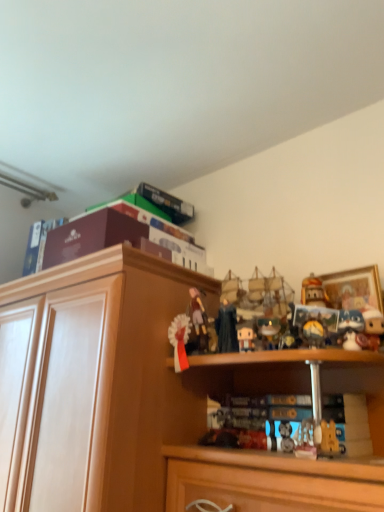
The height and width of the screenshot is (512, 384). Find the location of `wooden cabinet at upper center`. wooden cabinet at upper center is located at coordinates (105, 383).

How much space does white matte figurine at center, which is counted as the 2th toy, starting from the right, occupy horizontally?

white matte figurine at center, which is counted as the 2th toy, starting from the right, is 1.29 inches wide.

The height and width of the screenshot is (512, 384). What do you see at coordinates (179, 340) in the screenshot? I see `white glossy ribbon at center, which ranks as the first toy in left-to-right order` at bounding box center [179, 340].

The image size is (384, 512). Find the location of `wooden cabinet at upper center`. wooden cabinet at upper center is located at coordinates (105, 383).

Which is correct: white matte figurine at center, which is counted as the 2th toy, starting from the right, is inside wooden framed picture at upper right, or outside of it?

white matte figurine at center, which is counted as the 2th toy, starting from the right, cannot be found inside wooden framed picture at upper right.

Is white matte figurine at center, positioned as the fourth toy in left-to-right order, taller than wooden framed picture at upper right?

No.

Considering the sizes of objects white matte figurine at center, positioned as the fourth toy in left-to-right order, and wooden framed picture at upper right in the image provided, who is wider, white matte figurine at center, positioned as the fourth toy in left-to-right order, or wooden framed picture at upper right?

wooden framed picture at upper right.

Does point (239, 337) lie in front of point (375, 287)?

Yes, point (239, 337) is in front of point (375, 287).

Which is more to the right, white matte figurine at center, which is counted as the 2th toy, starting from the right, or maroon cardboard box at upper left, the 3th book in the right-to-left sequence?

From the viewer's perspective, white matte figurine at center, which is counted as the 2th toy, starting from the right, appears more on the right side.

From the image's perspective, which object appears higher, white matte figurine at center, which is counted as the 2th toy, starting from the right, or maroon cardboard box at upper left, the 3th book in the right-to-left sequence?

maroon cardboard box at upper left, the 3th book in the right-to-left sequence, is shown above in the image.

Which object is further away from the camera, white matte figurine at center, which is counted as the 2th toy, starting from the right, or maroon cardboard box at upper left, the 2th book positioned from the left?

Positioned behind is maroon cardboard box at upper left, the 2th book positioned from the left.

Does white matte figurine at center, positioned as the fourth toy in left-to-right order, have a lesser height compared to maroon cardboard box at upper left, the 2th book positioned from the left?

Correct, white matte figurine at center, positioned as the fourth toy in left-to-right order, is not as tall as maroon cardboard box at upper left, the 2th book positioned from the left.

Could you tell me if dark blue fabric figurine at center, which appears as the 3th toy when viewed from the right, is facing white glossy ribbon at center, which ranks as the fifth toy in right-to-left order?

No, dark blue fabric figurine at center, which appears as the 3th toy when viewed from the right, is not oriented towards white glossy ribbon at center, which ranks as the fifth toy in right-to-left order.

Consider the image. Are dark blue fabric figurine at center, the third toy in the left-to-right sequence, and white glossy ribbon at center, which ranks as the first toy in left-to-right order, making contact?

No, dark blue fabric figurine at center, the third toy in the left-to-right sequence, is not beside white glossy ribbon at center, which ranks as the first toy in left-to-right order.

How far apart are dark blue fabric figurine at center, which appears as the 3th toy when viewed from the right, and white glossy ribbon at center, which ranks as the fifth toy in right-to-left order?

They are 4.57 inches apart.

Considering the relative positions of dark blue fabric figurine at center, the third toy in the left-to-right sequence, and white glossy ribbon at center, which ranks as the first toy in left-to-right order, in the image provided, is dark blue fabric figurine at center, the third toy in the left-to-right sequence, in front of white glossy ribbon at center, which ranks as the first toy in left-to-right order,?

Yes, the depth of dark blue fabric figurine at center, the third toy in the left-to-right sequence, is less than that of white glossy ribbon at center, which ranks as the first toy in left-to-right order.

Could you tell me if hardcover book at upper center, marked as the second book in a right-to-left arrangement, is turned towards matte brown figurine at center, which is the second toy in left-to-right order?

No, hardcover book at upper center, marked as the second book in a right-to-left arrangement, is not oriented towards matte brown figurine at center, which is the second toy in left-to-right order.

Is hardcover book at upper center, the third book from the left, positioned far away from matte brown figurine at center, which is the second toy in left-to-right order?

No, there isn't a large distance between hardcover book at upper center, the third book from the left, and matte brown figurine at center, which is the second toy in left-to-right order.

Considering the positions of points (111, 202) and (196, 324), is point (111, 202) farther from camera compared to point (196, 324)?

Yes, point (111, 202) is behind point (196, 324).

Which object is wider, hardcover book at upper center, marked as the second book in a right-to-left arrangement, or matte brown figurine at center, which is the second toy in left-to-right order?

hardcover book at upper center, marked as the second book in a right-to-left arrangement.

Which is more to the right, white matte figurine at center, which is counted as the 2th toy, starting from the right, or white glossy ribbon at center, which ranks as the fifth toy in right-to-left order?

From the viewer's perspective, white matte figurine at center, which is counted as the 2th toy, starting from the right, appears more on the right side.

Between point (253, 334) and point (179, 319), which one is positioned behind?

The point (179, 319) is more distant.

How far apart are white matte figurine at center, which is counted as the 2th toy, starting from the right, and white glossy ribbon at center, which ranks as the first toy in left-to-right order?

A distance of 6.78 inches exists between white matte figurine at center, which is counted as the 2th toy, starting from the right, and white glossy ribbon at center, which ranks as the first toy in left-to-right order.

Is white matte figurine at center, which is counted as the 2th toy, starting from the right, closer to the viewer compared to white glossy ribbon at center, which ranks as the first toy in left-to-right order?

Yes, white matte figurine at center, which is counted as the 2th toy, starting from the right, is in front of white glossy ribbon at center, which ranks as the first toy in left-to-right order.

From the image's perspective, is matte brown figurine at center, which is the second toy in left-to-right order, above dark blue fabric figurine at center, the third toy in the left-to-right sequence?

Indeed, from the image's perspective, matte brown figurine at center, which is the second toy in left-to-right order, is shown above dark blue fabric figurine at center, the third toy in the left-to-right sequence.

Who is smaller, matte brown figurine at center, which is the second toy in left-to-right order, or dark blue fabric figurine at center, the third toy in the left-to-right sequence?

Smaller between the two is dark blue fabric figurine at center, the third toy in the left-to-right sequence.

Considering the sizes of objects matte brown figurine at center, which is the second toy in left-to-right order, and dark blue fabric figurine at center, the third toy in the left-to-right sequence, in the image provided, who is wider, matte brown figurine at center, which is the second toy in left-to-right order, or dark blue fabric figurine at center, the third toy in the left-to-right sequence,?

Wider between the two is matte brown figurine at center, which is the second toy in left-to-right order.

Is matte brown figurine at center, the fourth toy positioned from the right, in contact with dark blue fabric figurine at center, which appears as the 3th toy when viewed from the right?

No, matte brown figurine at center, the fourth toy positioned from the right, is not beside dark blue fabric figurine at center, which appears as the 3th toy when viewed from the right.

Does white glossy ribbon at center, which ranks as the fifth toy in right-to-left order, turn towards white matte figurine at center, which is counted as the 2th toy, starting from the right?

No.

Is white glossy ribbon at center, which ranks as the fifth toy in right-to-left order, shorter than white matte figurine at center, positioned as the fourth toy in left-to-right order?

No, white glossy ribbon at center, which ranks as the fifth toy in right-to-left order, is not shorter than white matte figurine at center, positioned as the fourth toy in left-to-right order.

Does white glossy ribbon at center, which ranks as the first toy in left-to-right order, come behind white matte figurine at center, which is counted as the 2th toy, starting from the right?

Yes, white glossy ribbon at center, which ranks as the first toy in left-to-right order, is further from the camera.

Considering the sizes of objects white glossy ribbon at center, which ranks as the fifth toy in right-to-left order, and white matte figurine at center, positioned as the fourth toy in left-to-right order, in the image provided, who is wider, white glossy ribbon at center, which ranks as the fifth toy in right-to-left order, or white matte figurine at center, positioned as the fourth toy in left-to-right order,?

With larger width is white matte figurine at center, positioned as the fourth toy in left-to-right order.

Where is `picture frame behind the white matte figurine at center, which is counted as the 2th toy, starting from the right`? Image resolution: width=384 pixels, height=512 pixels. picture frame behind the white matte figurine at center, which is counted as the 2th toy, starting from the right is located at coordinates (353, 288).

From a real-world perspective, starting from the white matte figurine at center, positioned as the fourth toy in left-to-right order, which book is the 1st one vertically above it? Please provide its 2D coordinates.

[(91, 236)]

Which object lies nearer to the anchor point white plush toy at right, the first toy positioned from the right, wooden cabinet at upper center or wooden framed picture at upper right?

Among the two, wooden framed picture at upper right is located nearer to white plush toy at right, the first toy positioned from the right.

Estimate the real-world distances between objects in this image. Which object is further from white matte figurine at center, which is counted as the 2th toy, starting from the right, white plush toy at right, the first toy positioned from the right, or maroon cardboard box at upper left, the 3th book in the right-to-left sequence?

Among the two, maroon cardboard box at upper left, the 3th book in the right-to-left sequence, is located further to white matte figurine at center, which is counted as the 2th toy, starting from the right.

Looking at the image, which one is located closer to matte plastic book at lower center, the fourth book positioned from the left, maroon cardboard box at upper left, the 2th book positioned from the left, or maroon cardboard box at upper left, which is the first book in left-to-right order?

maroon cardboard box at upper left, the 2th book positioned from the left, is closer to matte plastic book at lower center, the fourth book positioned from the left.

Estimate the real-world distances between objects in this image. Which object is further from white plush toy at right, the first toy positioned from the right, maroon cardboard box at upper left, the fourth book positioned from the right, or wooden cabinet at upper center?

maroon cardboard box at upper left, the fourth book positioned from the right, lies further to white plush toy at right, the first toy positioned from the right, than the other object.

Based on their spatial positions, is dark blue fabric figurine at center, the third toy in the left-to-right sequence, or wooden cabinet at upper center further from hardcover book at upper center, marked as the second book in a right-to-left arrangement?

dark blue fabric figurine at center, the third toy in the left-to-right sequence.

Estimate the real-world distances between objects in this image. Which object is further from maroon cardboard box at upper left, the 2th book positioned from the left, white matte figurine at center, which is counted as the 2th toy, starting from the right, or white plush toy at right, the first toy positioned from the right?

white plush toy at right, the first toy positioned from the right, is positioned further to the anchor maroon cardboard box at upper left, the 2th book positioned from the left.

Which object lies nearer to the anchor point maroon cardboard box at upper left, the fourth book positioned from the right, matte plastic book at lower center, positioned as the first book in right-to-left order, or matte brown figurine at center, the fourth toy positioned from the right?

matte brown figurine at center, the fourth toy positioned from the right, is closer to maroon cardboard box at upper left, the fourth book positioned from the right.

Consider the image. From the image, which object appears to be nearer to white plush toy at right, the first toy positioned from the right, maroon cardboard box at upper left, which is the first book in left-to-right order, or dark blue fabric figurine at center, which appears as the 3th toy when viewed from the right?

dark blue fabric figurine at center, which appears as the 3th toy when viewed from the right, lies closer to white plush toy at right, the first toy positioned from the right, than the other object.

Identify the location of toy situated between maroon cardboard box at upper left, the 3th book in the right-to-left sequence, and matte brown figurine at center, which is the second toy in left-to-right order, from left to right. This screenshot has height=512, width=384. (179, 340).

In order to click on toy between maroon cardboard box at upper left, which is the first book in left-to-right order, and matte brown figurine at center, which is the second toy in left-to-right order, from left to right in this screenshot , I will do `click(179, 340)`.

This screenshot has height=512, width=384. I want to click on cabinetry situated between maroon cardboard box at upper left, which is the first book in left-to-right order, and wooden framed picture at upper right from left to right, so click(x=105, y=383).

This screenshot has width=384, height=512. I want to click on book situated between hardcover book at upper center, marked as the second book in a right-to-left arrangement, and wooden framed picture at upper right from left to right, so [291, 424].